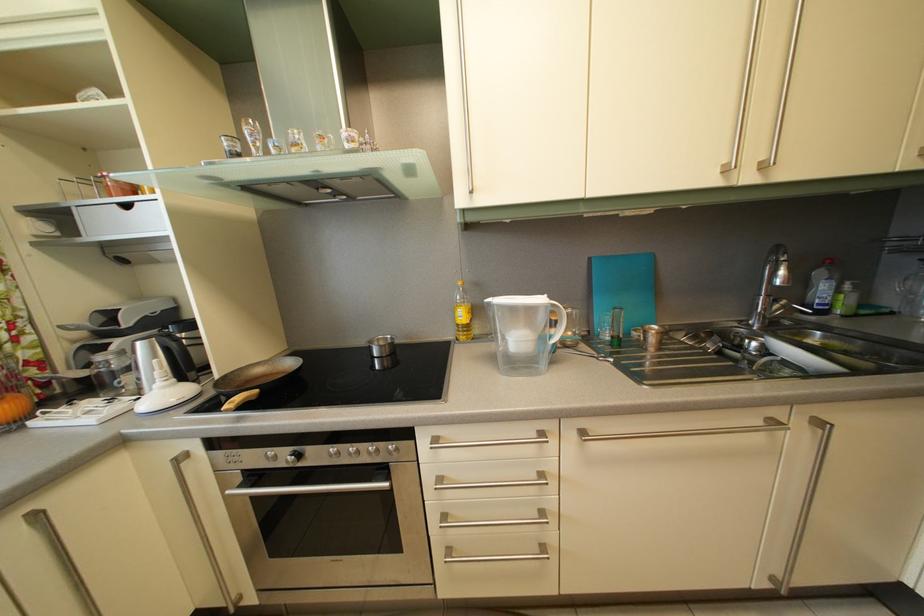
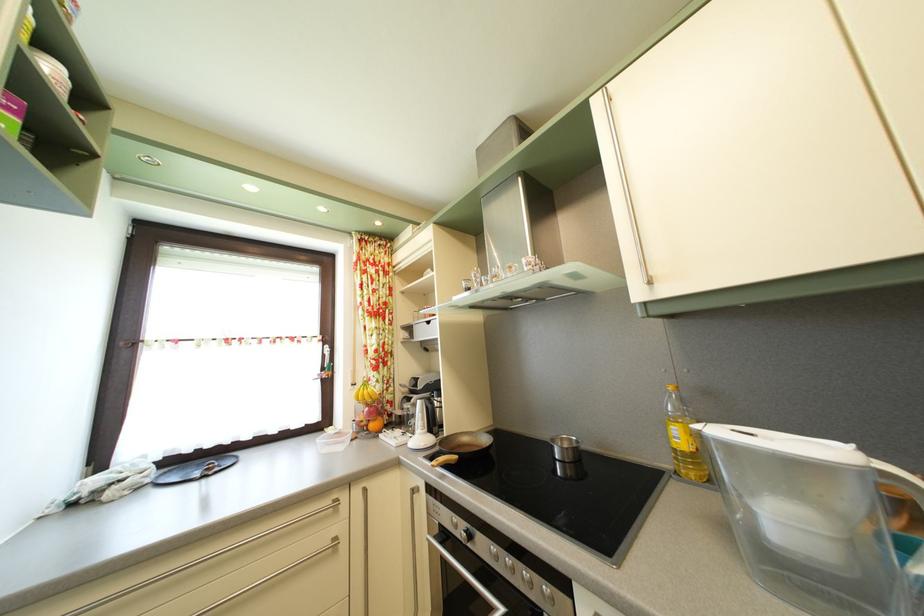
Where in the second image is the point corresponding to [110,355] from the first image?

(417, 407)